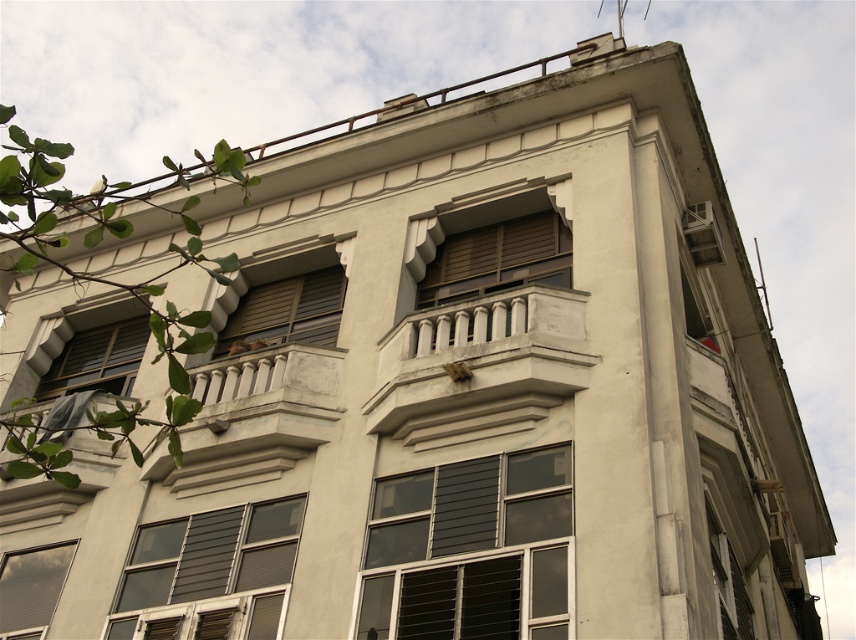
This screenshot has width=856, height=640. Describe the element at coordinates (254, 419) in the screenshot. I see `white concrete balcony at center` at that location.

Identify the location of white concrete balcony at center. The height and width of the screenshot is (640, 856). (254, 419).

This screenshot has width=856, height=640. In order to click on white concrete balcony at center in this screenshot , I will do `click(254, 419)`.

Between white stone balcony at center and wooden slats at center, which one is positioned higher?

white stone balcony at center is higher up.

Which is below, white stone balcony at center or wooden slats at center?

wooden slats at center is below.

Does point (402, 392) come farther from viewer compared to point (286, 288)?

No, (402, 392) is in front of (286, 288).

Identify the location of white stone balcony at center. The image size is (856, 640). (480, 368).

Describe the element at coordinates (210, 572) in the screenshot. I see `matte gray window at lower left` at that location.

Is matte gray window at lower left shorter than matte glass window at lower left?

Yes.

Describe the element at coordinates (210, 572) in the screenshot. This screenshot has height=640, width=856. I see `matte gray window at lower left` at that location.

Find the location of `matte gray window at lower left`. matte gray window at lower left is located at coordinates (210, 572).